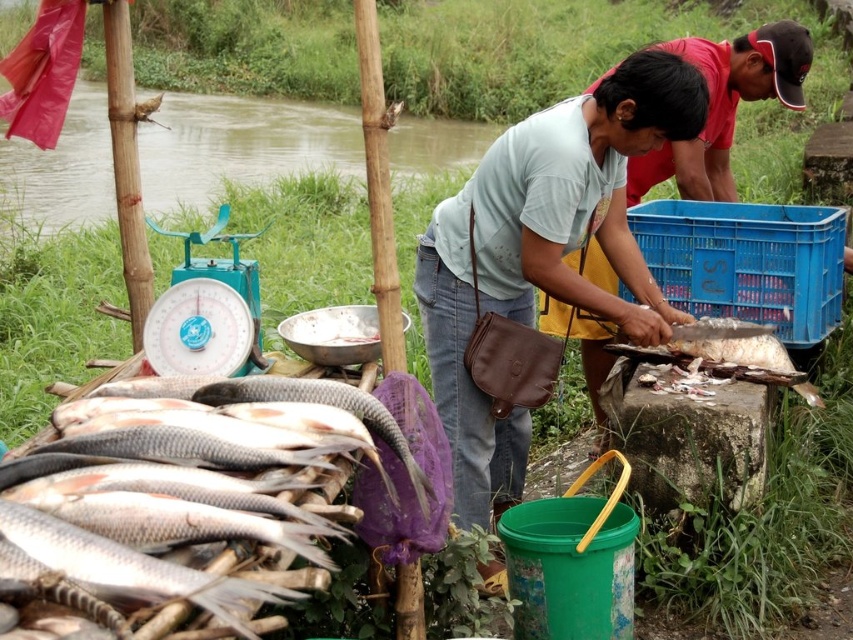
The image size is (853, 640). What do you see at coordinates (187, 502) in the screenshot? I see `white matte fish at lower left` at bounding box center [187, 502].

Which is behind, point (241, 632) or point (283, 596)?

Positioned behind is point (283, 596).

Measure the distance between white matte fish at lower left and camera.

white matte fish at lower left is 4.14 feet from camera.

The width and height of the screenshot is (853, 640). Identify the location of white matte fish at lower left. (187, 502).

Can you confirm if white glossy fish at lower left is positioned to the right of teal metallic scale at center-left?

Yes, white glossy fish at lower left is to the right of teal metallic scale at center-left.

Which is in front, point (109, 564) or point (241, 372)?

Point (109, 564) is more forward.

Image resolution: width=853 pixels, height=640 pixels. Describe the element at coordinates (129, 566) in the screenshot. I see `white glossy fish at lower left` at that location.

Image resolution: width=853 pixels, height=640 pixels. Find the location of `white glossy fish at lower left`. white glossy fish at lower left is located at coordinates (129, 566).

Between white matte fish at lower left and teal metallic scale at center-left, which one has less height?

teal metallic scale at center-left is shorter.

Is white matte fish at lower left bigger than teal metallic scale at center-left?

Yes.

Which is behind, point (389, 424) or point (212, 228)?

Point (212, 228)

Locate an element on the screen. white matte fish at lower left is located at coordinates (187, 502).